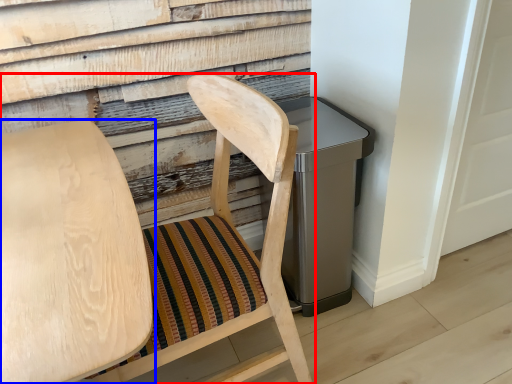
Question: Which object appears farthest to the camera in this image, chair (highlighted by a red box) or chair (highlighted by a blue box)?

Choices:
 (A) chair
 (B) chair

Answer: (A)